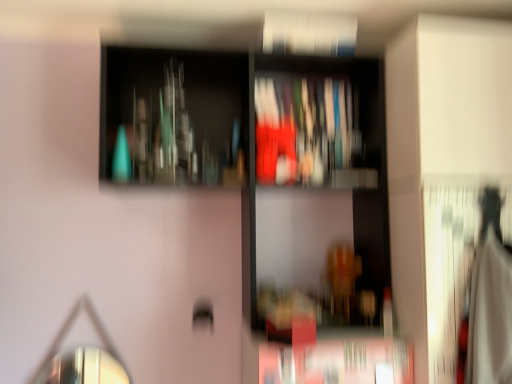
Question: In the image, is white paper book at upper center, acting as the first book starting from the front, on the left side or the right side of matte glass bottles at upper center?

Choices:
 (A) right
 (B) left

Answer: (A)

Question: Based on their sizes in the image, would you say white paper book at upper center, acting as the first book starting from the front, is bigger or smaller than matte glass bottles at upper center?

Choices:
 (A) small
 (B) big

Answer: (A)

Question: Which object is the farthest from the matte glass bottles at upper center?

Choices:
 (A) white paper book at upper center, acting as the first book starting from the front
 (B) shiny metallic mirror at lower left
 (C) matte plastic book at center, acting as the first book starting from the bottom

Answer: (B)

Question: Which object is positioned farthest from the matte glass bottles at upper center?

Choices:
 (A) matte plastic book at center, acting as the first book starting from the bottom
 (B) white paper book at upper center, the 1th book positioned from the top
 (C) shiny metallic mirror at lower left

Answer: (C)